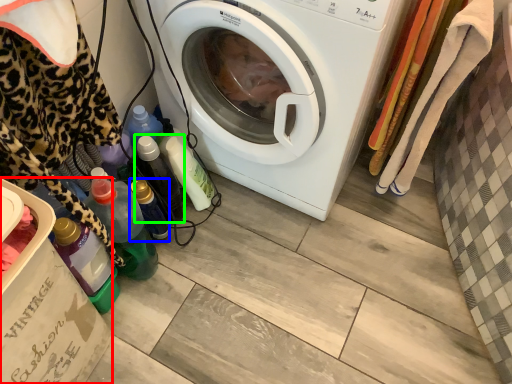
Question: Which object is positioned farthest from cardboard box (highlighted by a red box)? Select from bottle (highlighted by a blue box) and bottle (highlighted by a green box).

Choices:
 (A) bottle
 (B) bottle

Answer: (B)